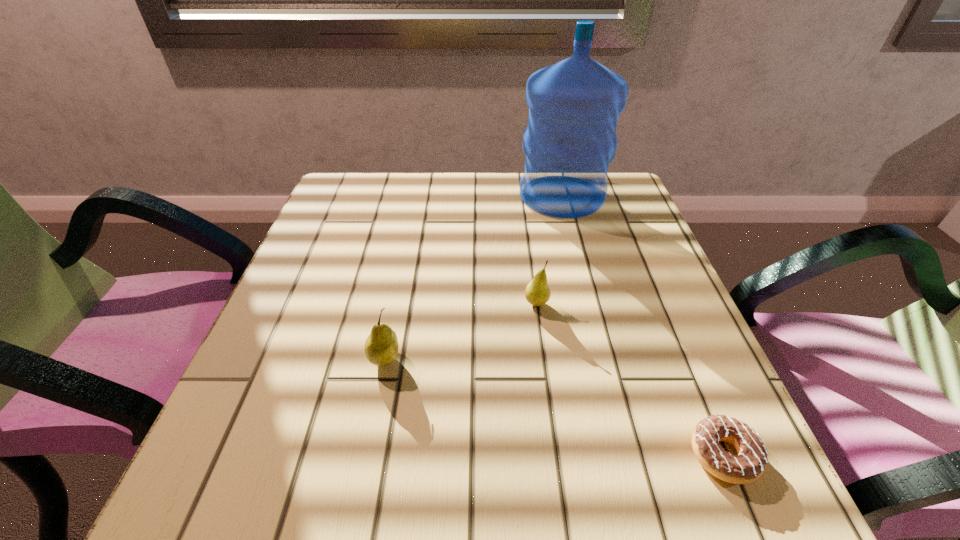
Where is `free space located on the back of the leftmost object`? free space located on the back of the leftmost object is located at coordinates (397, 294).

I want to click on free region located 0.250m on the back of the doughnut, so click(660, 303).

Where is `object that is at the far edge`? object that is at the far edge is located at coordinates (574, 105).

Locate an element on the screen. object that is at the near edge is located at coordinates (750, 463).

Find the location of a particular element. This screenshot has height=540, width=960. water jug positioned at the right edge is located at coordinates (574, 105).

Locate an element on the screen. doughnut located in the right edge section of the desktop is located at coordinates (750, 463).

Find the location of a particular element. object present at the far right corner is located at coordinates (574, 105).

You are a GUI agent. You are given a task and a screenshot of the screen. Output one action in this format:
    pyautogui.click(x=<x>, y=<y>)
    Task: Click on the object at the near right corner
    
    Given the screenshot: What is the action you would take?
    pyautogui.click(x=750, y=463)

I want to click on vacant area at the far edge, so click(404, 177).

Find the location of a particular element. This screenshot has height=540, width=960. blank space at the left edge is located at coordinates (338, 336).